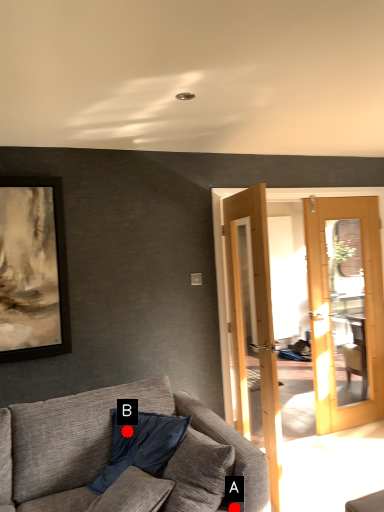
Question: Two points are circled on the image, labeled by A and B beside each circle. Which point is farther to the camera?

Choices:
 (A) A is further
 (B) B is further

Answer: (B)